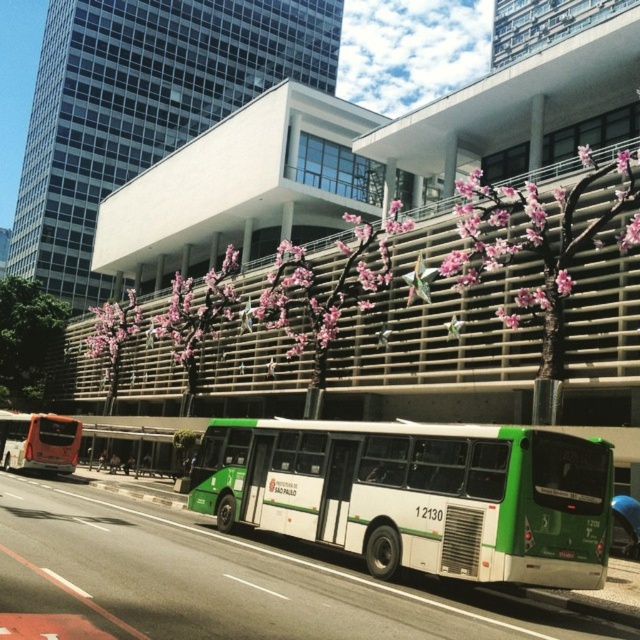
You are a pedestrian standing at the entrance of the building. You want to walk to the green leafy tree at lower left without getting wet from the rain. The green matte bus at center is blocking the direct path. Can you walk around the bus to reach the tree?

The green matte bus at center is positioned under green leafy tree at lower left, so the bus is located beneath the tree. To avoid the rain, you can walk around the sides of the bus to reach the tree since the bus is under the tree and not blocking the path directly.

You are standing at the entrance of the modern building and want to find the green matte bus at center. Which direction should you walk to locate it?

Since the green matte bus at center is located at point (x=417, y=493), you should walk towards the center of the scene to find it.

You are a city planner assessing the urban space in front of the building. You need to determine if the green leafy tree at lower left and the pink blossom tree at center can both fit within a 5 meter height restriction. Given their current heights, will both trees comply with the regulation?

The green leafy tree at lower left has a greater height compared to pink blossom tree at center. However, without specific measurements provided, it is impossible to determine if both trees comply with the 5 meter height restriction. Further information is needed.